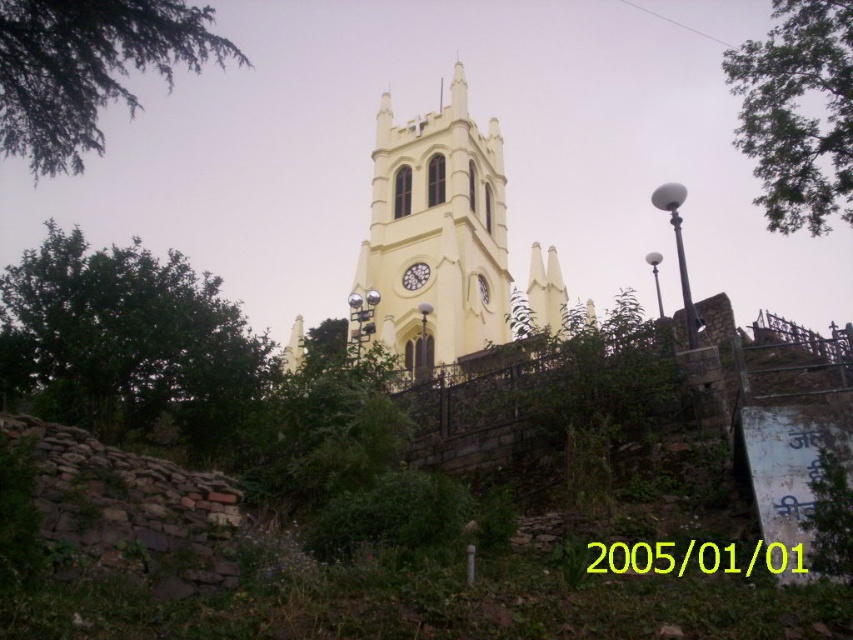
Question: Which point appears farthest from the camera in this image?

Choices:
 (A) (409, 285)
 (B) (828, 113)

Answer: (B)

Question: From the image, what is the correct spatial relationship of yellow matte clock tower at center in relation to yellow matte clock at center?

Choices:
 (A) left
 (B) right

Answer: (B)

Question: Which is nearer to the green leafy tree at left?

Choices:
 (A) yellow matte clock at center
 (B) yellow matte clock tower at center
 (C) green leafy branch at upper left
 (D) green leafy tree at upper right

Answer: (C)

Question: Can you confirm if green leafy tree at left is smaller than yellow matte clock tower at center?

Choices:
 (A) no
 (B) yes

Answer: (A)

Question: Considering the relative positions of yellow matte clock tower at center and green leafy branch at upper left in the image provided, where is yellow matte clock tower at center located with respect to green leafy branch at upper left?

Choices:
 (A) below
 (B) above

Answer: (A)

Question: Estimate the real-world distances between objects in this image. Which object is closer to the yellow matte clock tower at center?

Choices:
 (A) green leafy tree at left
 (B) yellow matte clock at center
 (C) green leafy branch at upper left

Answer: (B)